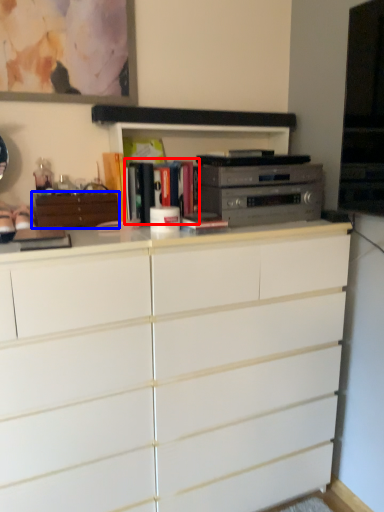
Question: Which object is closer to the camera taking this photo, book (highlighted by a red box) or cabinetry (highlighted by a blue box)?

Choices:
 (A) book
 (B) cabinetry

Answer: (B)